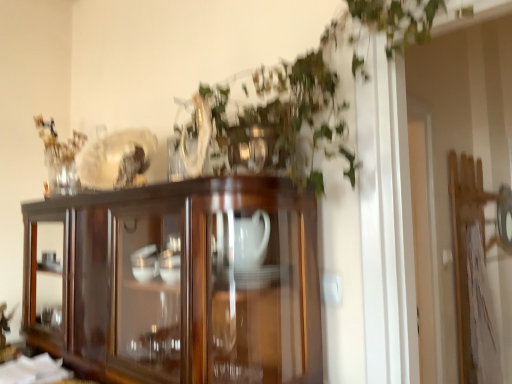
Question: Is dark wood cupboard at center wider or thinner than green leafy plant at upper center?

Choices:
 (A) wide
 (B) thin

Answer: (B)

Question: In terms of height, does dark wood cupboard at center look taller or shorter compared to green leafy plant at upper center?

Choices:
 (A) tall
 (B) short

Answer: (B)

Question: Is point (98, 253) positioned closer to the camera than point (392, 21)?

Choices:
 (A) farther
 (B) closer

Answer: (A)

Question: From the image's perspective, is green leafy plant at upper center positioned above or below dark wood cupboard at center?

Choices:
 (A) below
 (B) above

Answer: (B)

Question: Which is correct: green leafy plant at upper center is inside dark wood cupboard at center, or outside of it?

Choices:
 (A) outside
 (B) inside

Answer: (A)

Question: From a real-world perspective, is green leafy plant at upper center above or below dark wood cupboard at center?

Choices:
 (A) below
 (B) above

Answer: (B)

Question: Is point (394, 4) positioned closer to the camera than point (247, 336)?

Choices:
 (A) farther
 (B) closer

Answer: (B)